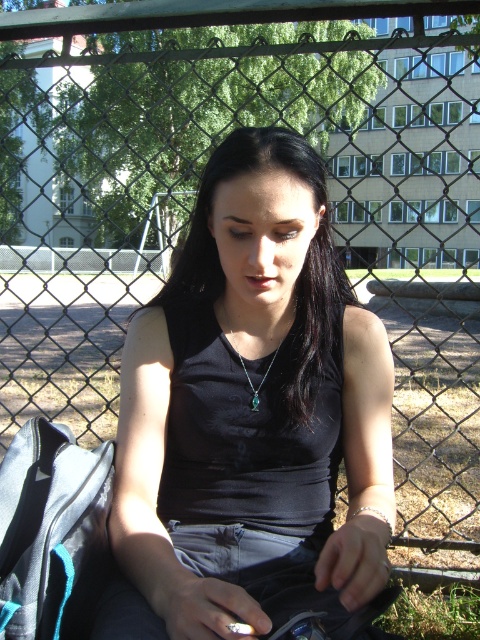
Question: Considering the real-world distances, which object is closest to the green grass at lower right?

Choices:
 (A) emerald green gemstone at center
 (B) black matte tank top at center

Answer: (B)

Question: Can you confirm if black matte tank top at center is smaller than emerald green gemstone at center?

Choices:
 (A) yes
 (B) no

Answer: (B)

Question: Among these points, which one is nearest to the camera?

Choices:
 (A) (442, 618)
 (B) (197, 403)
 (C) (255, 392)

Answer: (B)

Question: Which point is closer to the camera?

Choices:
 (A) black matte tank top at center
 (B) emerald green gemstone at center
 (C) green grass at lower right

Answer: (A)

Question: From the image, what is the correct spatial relationship of black matte tank top at center in relation to green grass at lower right?

Choices:
 (A) above
 (B) below

Answer: (A)

Question: Can you confirm if black matte tank top at center is wider than emerald green gemstone at center?

Choices:
 (A) no
 (B) yes

Answer: (B)